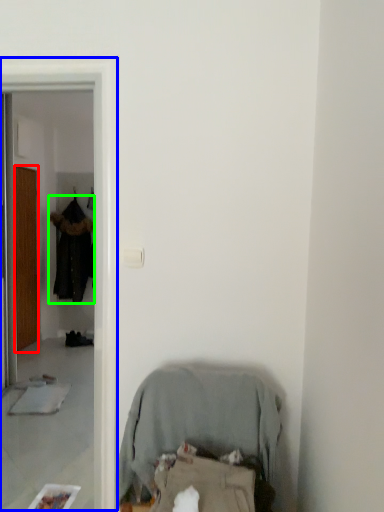
Question: Which is farther away from door (highlighted by a red box)? screen door (highlighted by a blue box) or clothing (highlighted by a green box)?

Choices:
 (A) screen door
 (B) clothing

Answer: (A)